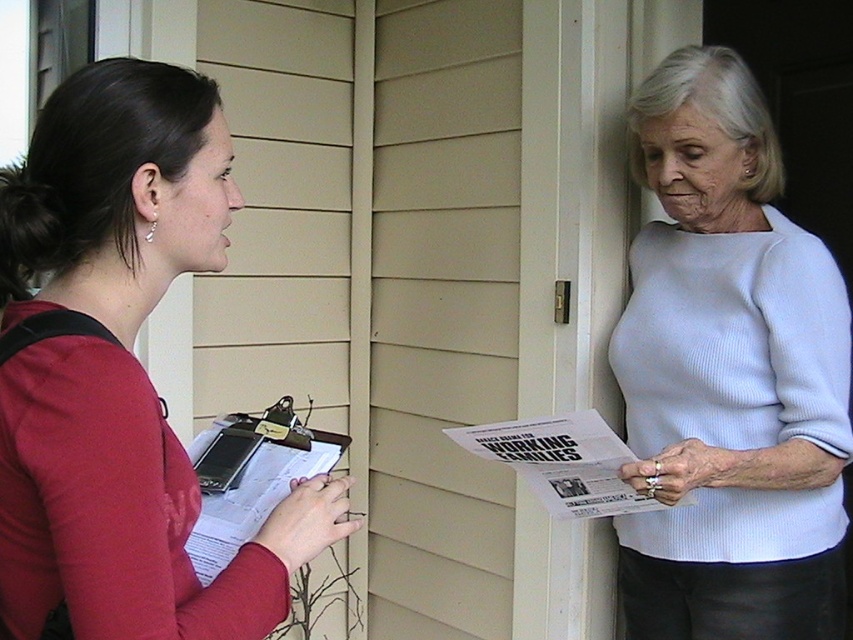
In the scene shown: You are a photographer trying to capture both the matte red shirt at left and the light blue ribbed sweater at upper right in a single frame. Based on their heights, which subject should you adjust your camera angle to focus on first to ensure both are fully visible?

The matte red shirt at left is shorter than the light blue ribbed sweater at upper right. To ensure both are fully visible, you should first focus on the light blue ribbed sweater at upper right, then adjust your angle to include the shorter matte red shirt at left.

You are a photographer trying to capture both the matte red shirt at left and the light blue ribbed sweater at upper right in a single frame. Based on their positions, which one is closer to the camera?

The matte red shirt at left is positioned over the light blue ribbed sweater at upper right, which means it is closer to the camera.

You are standing in front of a house and see the matte red shirt at left and the white glossy paper at center. Which object is nearer to you?

The matte red shirt at left is closer to the viewer than the white glossy paper at center.